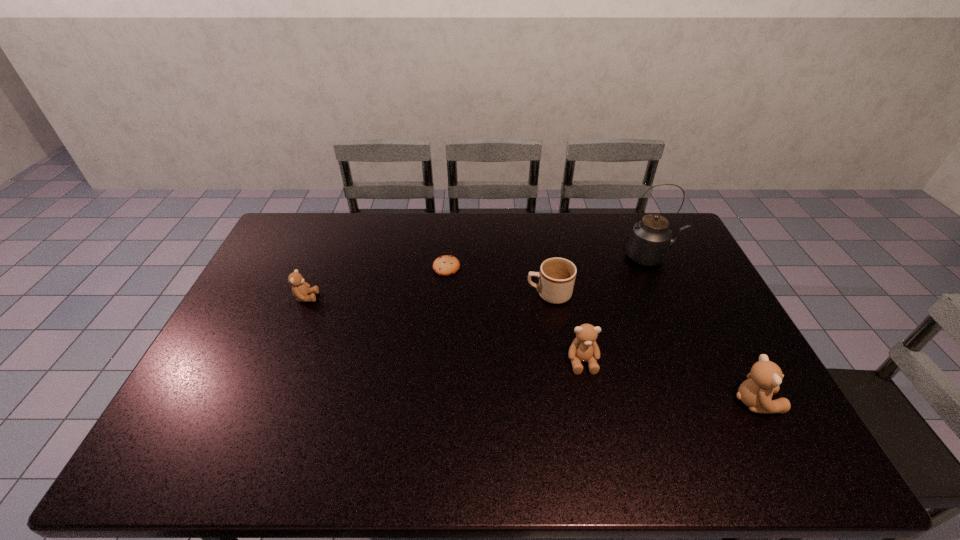
Please point a spot to place another teddy_bear for symmetrical spacing. Please provide its 2D coordinates. Your answer should be formatted as a tuple, i.e. [(x, y)], where the tuple contains the x and y coordinates of a point satisfying the conditions above.

[(434, 327)]